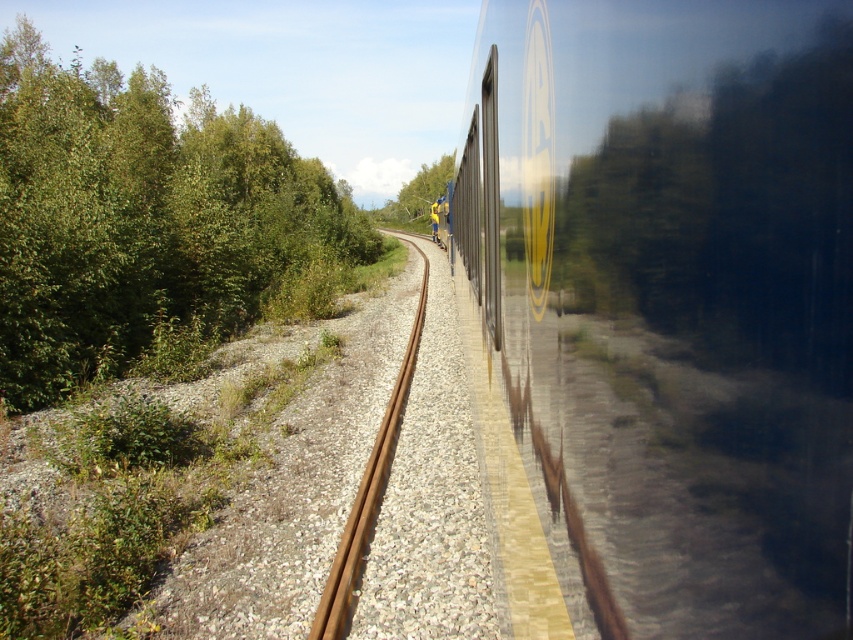
Question: Is metallic silver train at right smaller than rusty metal train track at center?

Choices:
 (A) yes
 (B) no

Answer: (A)

Question: Among these objects, which one is farthest from the camera?

Choices:
 (A) green leafy tree at center
 (B) green leafy trees at left
 (C) metallic silver train at right

Answer: (A)

Question: Which object is farther from the camera taking this photo?

Choices:
 (A) green leafy trees at left
 (B) metallic silver train at right

Answer: (A)

Question: Which object is farther from the camera taking this photo?

Choices:
 (A) green leafy trees at left
 (B) rusty metal train track at center
 (C) green leafy tree at center
 (D) metallic silver train at right

Answer: (C)

Question: Is rusty metal train track at center closer to camera compared to green leafy tree at center?

Choices:
 (A) no
 (B) yes

Answer: (B)

Question: Can you confirm if green leafy trees at left is smaller than green leafy tree at center?

Choices:
 (A) no
 (B) yes

Answer: (A)